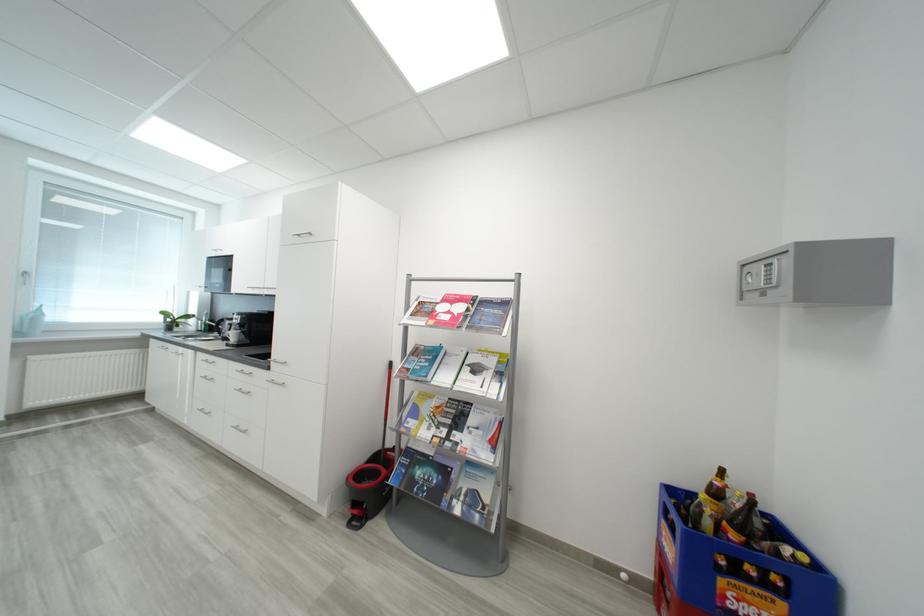
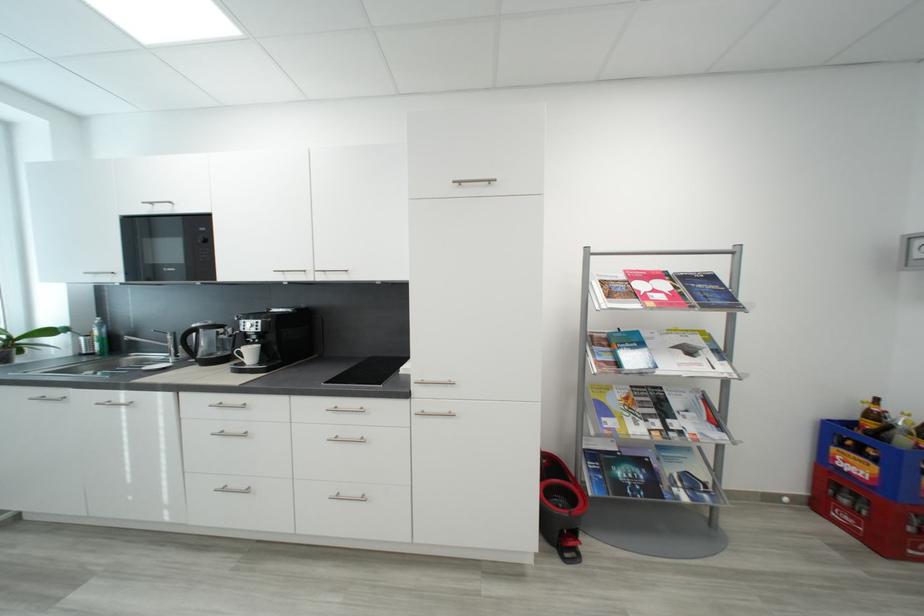
Locate, in the second image, the point that corresponds to [679,530] in the first image.

(867, 454)